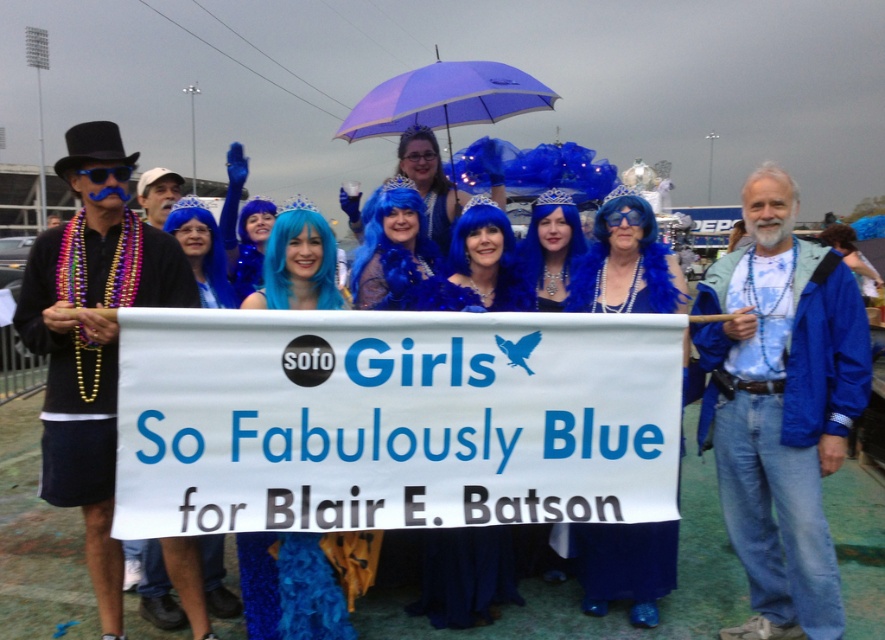
Who is higher up, matte black jacket at left or fuzzy blue boa at center?

matte black jacket at left is above.

Who is more distant from viewer, (137, 250) or (585, 595)?

The point (585, 595) is more distant.

Where is `matte black jacket at left`? Image resolution: width=885 pixels, height=640 pixels. matte black jacket at left is located at coordinates (91, 337).

What are the coordinates of `matte black jacket at left` in the screenshot? It's located at (91, 337).

Can you confirm if matte black jacket at left is thinner than purple fabric umbrella at upper center?

No.

Does matte black jacket at left come in front of purple fabric umbrella at upper center?

Yes.

Image resolution: width=885 pixels, height=640 pixels. I want to click on matte black jacket at left, so click(91, 337).

The height and width of the screenshot is (640, 885). I want to click on matte black jacket at left, so click(x=91, y=337).

What do you see at coordinates (781, 406) in the screenshot? The width and height of the screenshot is (885, 640). I see `blue denim jacket at lower right` at bounding box center [781, 406].

Which is above, blue denim jacket at lower right or fuzzy blue boa at center?

blue denim jacket at lower right is higher up.

Between point (845, 339) and point (668, 536), which one is positioned behind?

The point (668, 536) is behind.

The width and height of the screenshot is (885, 640). Find the location of `blue denim jacket at lower right`. blue denim jacket at lower right is located at coordinates (781, 406).